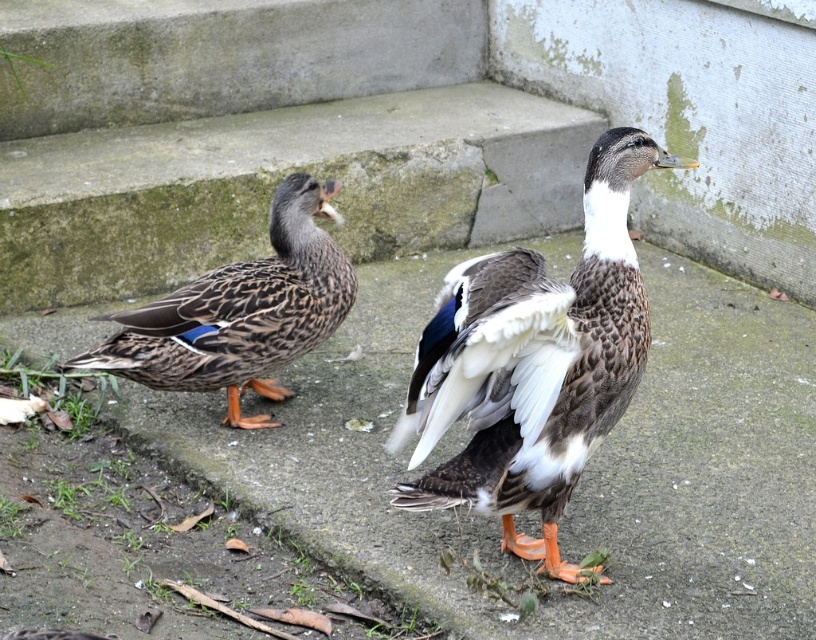
Between brown speckled duck at center and brown speckled feathers at left, which one has more height?

brown speckled duck at center

The image size is (816, 640). Find the location of `brown speckled duck at center`. brown speckled duck at center is located at coordinates (533, 364).

Does point (626, 316) come behind point (287, 262)?

No, (626, 316) is closer to viewer.

Locate an element on the screen. The width and height of the screenshot is (816, 640). brown speckled duck at center is located at coordinates (533, 364).

Is point (535, 634) farther from viewer compared to point (455, 413)?

Yes, it is behind point (455, 413).

Measure the distance from gray concrete pavement at center to brown speckled duck at center.

A distance of 28.90 inches exists between gray concrete pavement at center and brown speckled duck at center.

Locate an element on the screen. gray concrete pavement at center is located at coordinates (579, 477).

Can you confirm if gray concrete pavement at center is positioned above brown speckled feathers at left?

No, gray concrete pavement at center is not above brown speckled feathers at left.

Who is positioned more to the right, gray concrete pavement at center or brown speckled feathers at left?

gray concrete pavement at center is more to the right.

Which is in front, point (269, 476) or point (174, 333)?

Point (269, 476) is in front.

The image size is (816, 640). I want to click on gray concrete pavement at center, so [x=579, y=477].